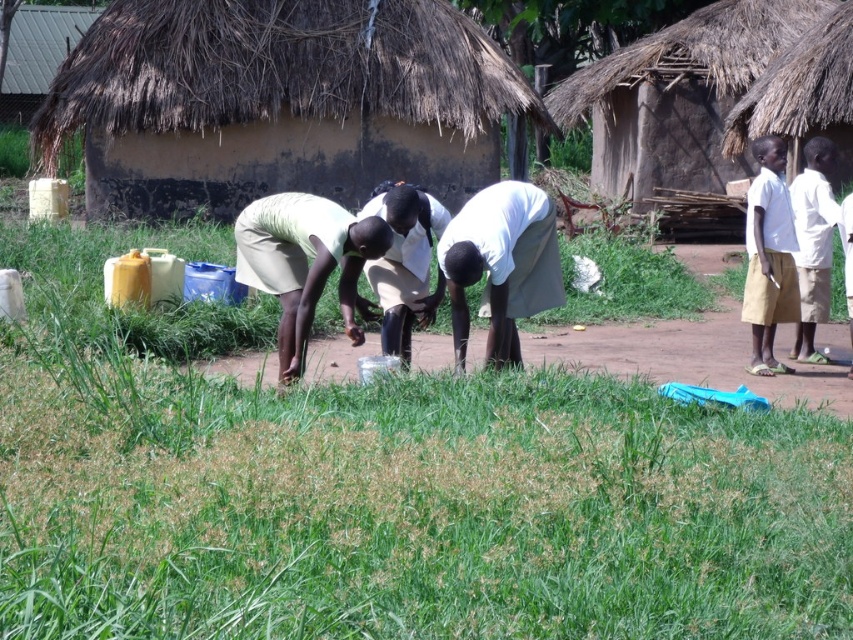
Consider the image. Does thatched straw hut at upper center appear on the left side of white cotton shirt at upper right?

Yes, thatched straw hut at upper center is to the left of white cotton shirt at upper right.

Does thatched straw hut at upper center have a larger size compared to white cotton shirt at upper right?

No.

What do you see at coordinates (277, 102) in the screenshot?
I see `thatched straw hut at upper center` at bounding box center [277, 102].

The height and width of the screenshot is (640, 853). I want to click on thatched straw hut at upper center, so click(277, 102).

From the picture: Between thatched straw hut at upper center and thatched straw hut at upper right, which one has less height?

With less height is thatched straw hut at upper center.

Who is positioned more to the left, thatched straw hut at upper center or thatched straw hut at upper right?

Positioned to the left is thatched straw hut at upper center.

Where is `thatched straw hut at upper center`? This screenshot has height=640, width=853. thatched straw hut at upper center is located at coordinates (277, 102).

This screenshot has width=853, height=640. Identify the location of thatched straw hut at upper center. (277, 102).

Is thatched straw hut at upper right to the left of white cotton shirt at upper right from the viewer's perspective?

Incorrect, thatched straw hut at upper right is not on the left side of white cotton shirt at upper right.

Is thatched straw hut at upper right behind white cotton shirt at upper right?

Yes, thatched straw hut at upper right is further from the viewer.

Locate an element on the screen. The image size is (853, 640). thatched straw hut at upper right is located at coordinates (677, 96).

Where is `thatched straw hut at upper right`? thatched straw hut at upper right is located at coordinates (677, 96).